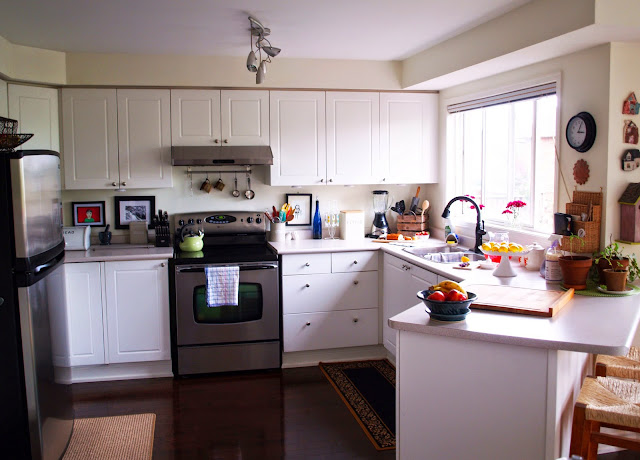
I want to click on ceiling, so click(x=355, y=18).